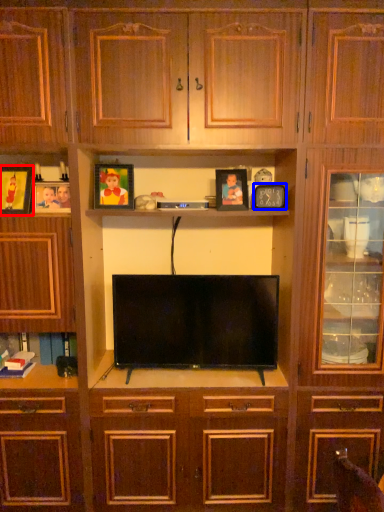
Question: Among these objects, which one is farthest to the camera, picture frame (highlighted by a red box) or picture frame (highlighted by a blue box)?

Choices:
 (A) picture frame
 (B) picture frame

Answer: (B)